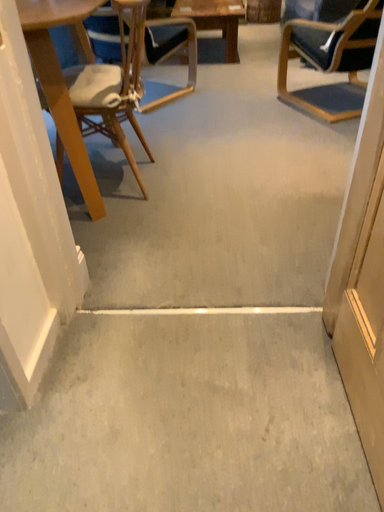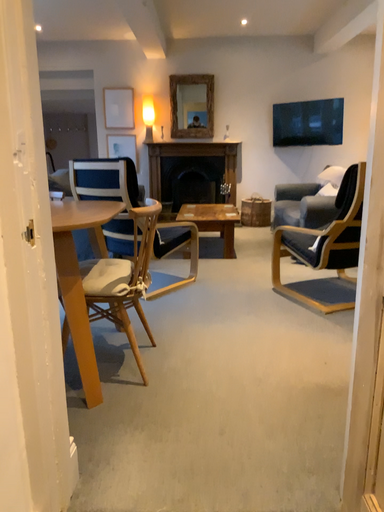
Question: Which way did the camera rotate in the video?

Choices:
 (A) rotated downward
 (B) rotated upward

Answer: (B)